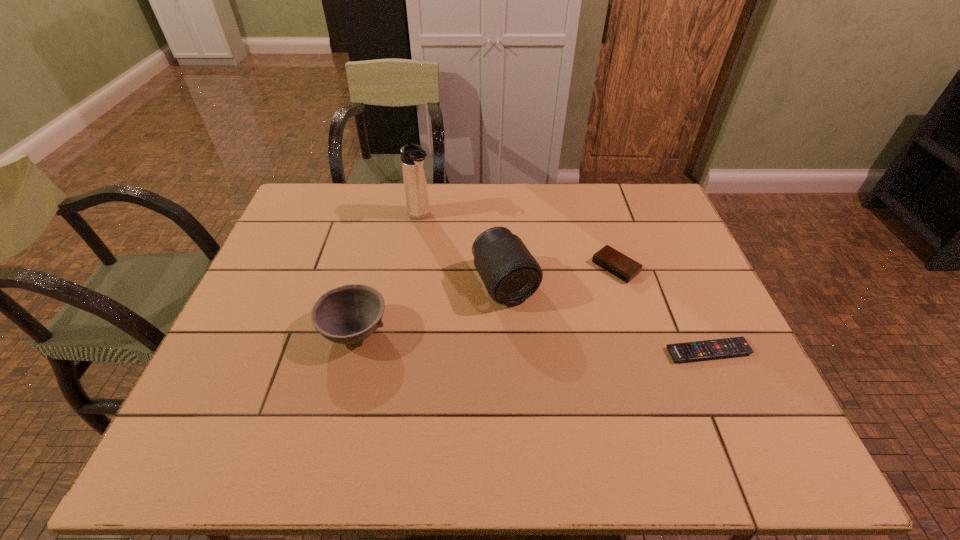
Locate an element on the screen. This screenshot has width=960, height=540. bowl is located at coordinates (348, 314).

Where is `the shortest object`? the shortest object is located at coordinates (689, 351).

I want to click on alarm clock, so click(608, 258).

Where is `thermos bottle`? thermos bottle is located at coordinates (412, 156).

Where is `the farthest object`? the farthest object is located at coordinates (412, 156).

Where is `the second tallest object`? This screenshot has height=540, width=960. the second tallest object is located at coordinates (510, 273).

Locate an element on the screen. telephoto lens is located at coordinates (510, 273).

At what (x,y) coordinates should I click in order to perform the action: click on vacant space located 0.360m on the back of the third shortest object. Please return your answer as a coordinate pair (x, y). The width and height of the screenshot is (960, 540). Looking at the image, I should click on (383, 221).

This screenshot has width=960, height=540. I want to click on vacant area located on the left of the remote control, so click(x=595, y=352).

Identify the location of vacant position located 0.080m on the front face of the second shortest object. (585, 293).